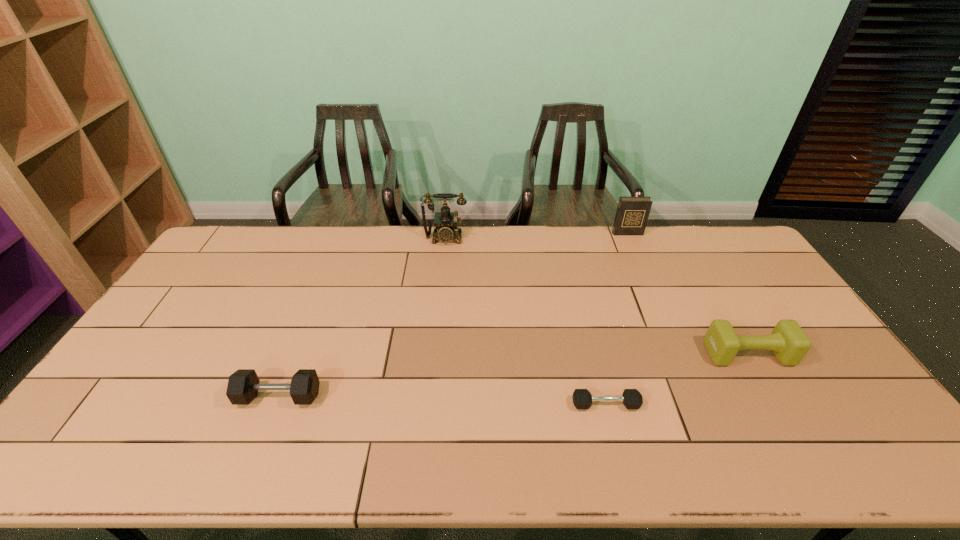
Find the location of `vacant area in the image that satisfies the following two spatial constraints: 1. on the rotary dial of the second dumbbell from right to left; 2. on the right side of the tallest object`. vacant area in the image that satisfies the following two spatial constraints: 1. on the rotary dial of the second dumbbell from right to left; 2. on the right side of the tallest object is located at coordinates (429, 404).